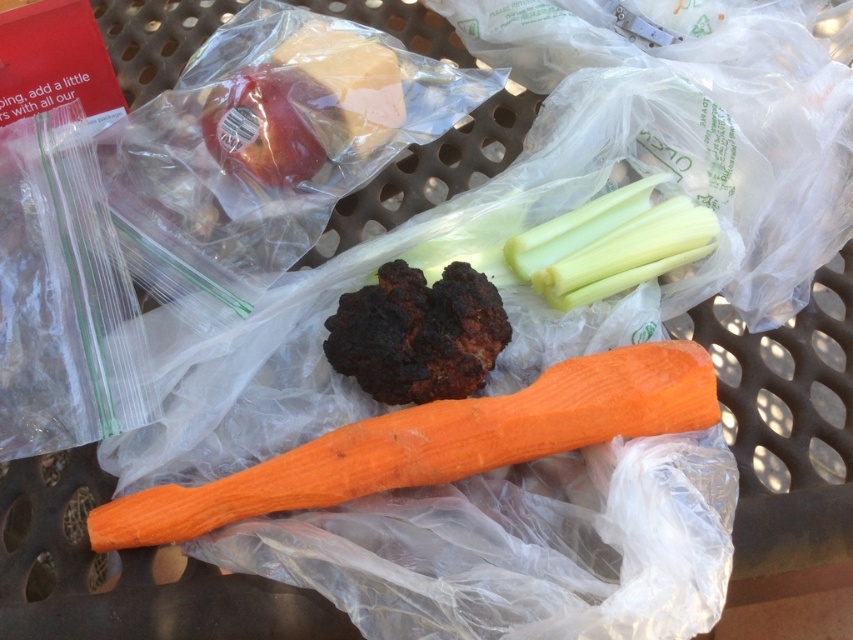
You are organizing a picnic and need to place the orange smooth carrot at center on the table. According to the image, where exactly should you position it?

The orange smooth carrot at center should be placed at point coordinates (436, 444) as per the image description.

You are setting up a picnic and need to stack the orange smooth carrot at center and the red matte apple at upper left vertically. Which one should you place at the bottom to ensure stability?

The orange smooth carrot at center should be placed at the bottom since it has a greater height than the red matte apple at upper left, providing a more stable base.